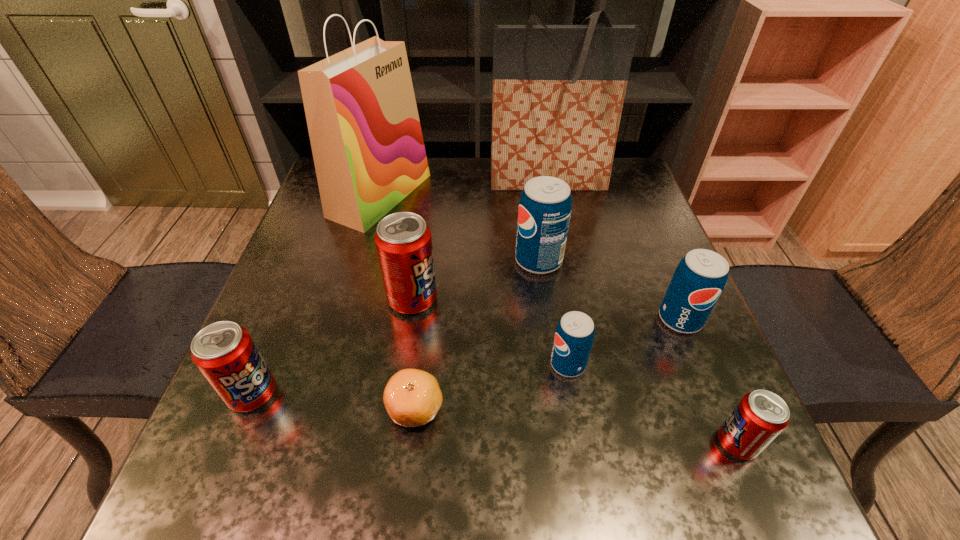
Where is `object situated at the near right corner`? The image size is (960, 540). object situated at the near right corner is located at coordinates (761, 415).

The width and height of the screenshot is (960, 540). Find the location of `free space at the far edge of the desktop`. free space at the far edge of the desktop is located at coordinates 487,202.

Where is `blank space at the left edge of the desktop`? Image resolution: width=960 pixels, height=540 pixels. blank space at the left edge of the desktop is located at coordinates (276, 283).

In the image, there is a desktop. Identify the location of free space at the right edge. (598, 222).

This screenshot has height=540, width=960. Find the location of `free space at the near left corner of the desktop`. free space at the near left corner of the desktop is located at coordinates (205, 496).

Identify the location of vacant area between the farthest blue pop and the fifth soda can from right to left. click(x=475, y=280).

Locate an element on the screen. This screenshot has height=540, width=960. free space that is in between the second smallest red soda can and the rightmost blue pop is located at coordinates (467, 356).

What are the coordinates of `free space between the biggest red soda can and the second smallest blue pop` in the screenshot? It's located at (546, 309).

Identify the location of free space between the orange clementine and the right shopping bag. This screenshot has width=960, height=540. (482, 294).

Where is `unoccupied position between the biggest blue pop and the orange clementine`? This screenshot has height=540, width=960. unoccupied position between the biggest blue pop and the orange clementine is located at coordinates (477, 334).